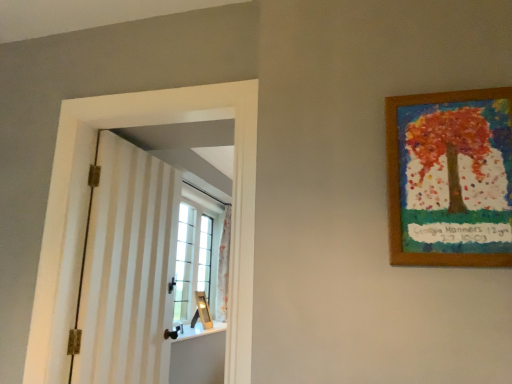
What do you see at coordinates (128, 268) in the screenshot?
I see `beige striped barn door at left` at bounding box center [128, 268].

The image size is (512, 384). What are the coordinates of `beige striped barn door at left` in the screenshot? It's located at (128, 268).

This screenshot has height=384, width=512. What do you see at coordinates (450, 178) in the screenshot?
I see `wooden picture frame at upper right` at bounding box center [450, 178].

The height and width of the screenshot is (384, 512). I want to click on wooden picture frame at upper right, so click(450, 178).

The height and width of the screenshot is (384, 512). In order to click on beige striped barn door at left in this screenshot , I will do `click(128, 268)`.

Considering the relative positions of wooden picture frame at upper right and beige striped barn door at left in the image provided, is wooden picture frame at upper right to the right of beige striped barn door at left from the viewer's perspective?

Indeed, wooden picture frame at upper right is positioned on the right side of beige striped barn door at left.

Does wooden picture frame at upper right come behind beige striped barn door at left?

That is False.

Is point (428, 235) behind point (147, 374)?

No, (428, 235) is closer to viewer.

From the image's perspective, is wooden picture frame at upper right beneath beige striped barn door at left?

No.

From a real-world perspective, is wooden picture frame at upper right beneath beige striped barn door at left?

No, from a real-world perspective, wooden picture frame at upper right is not under beige striped barn door at left.

Considering the sizes of objects wooden picture frame at upper right and beige striped barn door at left in the image provided, who is thinner, wooden picture frame at upper right or beige striped barn door at left?

With smaller width is wooden picture frame at upper right.

Does wooden picture frame at upper right have a greater height compared to beige striped barn door at left?

In fact, wooden picture frame at upper right may be shorter than beige striped barn door at left.

Who is smaller, wooden picture frame at upper right or beige striped barn door at left?

wooden picture frame at upper right is smaller.

Is wooden picture frame at upper right inside the boundaries of beige striped barn door at left, or outside?

wooden picture frame at upper right is located beyond the bounds of beige striped barn door at left.

Is there a large distance between wooden picture frame at upper right and beige striped barn door at left?

That's right, there is a large distance between wooden picture frame at upper right and beige striped barn door at left.

Is wooden picture frame at upper right oriented away from beige striped barn door at left?

wooden picture frame at upper right is not turned away from beige striped barn door at left.

How different are the orientations of wooden picture frame at upper right and beige striped barn door at left in degrees?

There is a 88.4-degree angle between the facing directions of wooden picture frame at upper right and beige striped barn door at left.

Measure the distance from wooden picture frame at upper right to beige striped barn door at left.

A distance of 1.47 meters exists between wooden picture frame at upper right and beige striped barn door at left.

This screenshot has width=512, height=384. In order to click on barn door below the wooden picture frame at upper right (from the image's perspective) in this screenshot , I will do `click(128, 268)`.

Which object is positioned more to the left, beige striped barn door at left or wooden picture frame at upper right?

beige striped barn door at left is more to the left.

Is beige striped barn door at left in front of or behind wooden picture frame at upper right in the image?

Visually, beige striped barn door at left is located behind wooden picture frame at upper right.

Which is behind, point (151, 359) or point (459, 243)?

The point (151, 359) is more distant.

Based on the photo, from the image's perspective, is beige striped barn door at left positioned above or below wooden picture frame at upper right?

Clearly, from the image's perspective, beige striped barn door at left is below wooden picture frame at upper right.

From a real-world perspective, who is located lower, beige striped barn door at left or wooden picture frame at upper right?

beige striped barn door at left is physically lower.

Considering the relative sizes of beige striped barn door at left and wooden picture frame at upper right in the image provided, is beige striped barn door at left wider than wooden picture frame at upper right?

Indeed, beige striped barn door at left has a greater width compared to wooden picture frame at upper right.

Can you confirm if beige striped barn door at left is shorter than wooden picture frame at upper right?

In fact, beige striped barn door at left may be taller than wooden picture frame at upper right.

Looking at this image, considering the relative sizes of beige striped barn door at left and wooden picture frame at upper right in the image provided, is beige striped barn door at left smaller than wooden picture frame at upper right?

Incorrect, beige striped barn door at left is not smaller in size than wooden picture frame at upper right.

Is beige striped barn door at left not within wooden picture frame at upper right?

Yes, beige striped barn door at left is outside of wooden picture frame at upper right.

Is beige striped barn door at left positioned far away from wooden picture frame at upper right?

Yes.

Does beige striped barn door at left turn towards wooden picture frame at upper right?

Yes.

How different are the orientations of beige striped barn door at left and wooden picture frame at upper right in degrees?

There is a 88.4-degree angle between the facing directions of beige striped barn door at left and wooden picture frame at upper right.

Measure the distance between beige striped barn door at left and wooden picture frame at upper right.

beige striped barn door at left is 4.81 feet from wooden picture frame at upper right.

The height and width of the screenshot is (384, 512). In order to click on picture frame that is on the right side of beige striped barn door at left in this screenshot , I will do `click(450, 178)`.

The image size is (512, 384). In the image, there is a beige striped barn door at left. Find the location of `picture frame above it (from the image's perspective)`. picture frame above it (from the image's perspective) is located at coordinates (450, 178).

What are the coordinates of `barn door lying behind the wooden picture frame at upper right` in the screenshot? It's located at (128, 268).